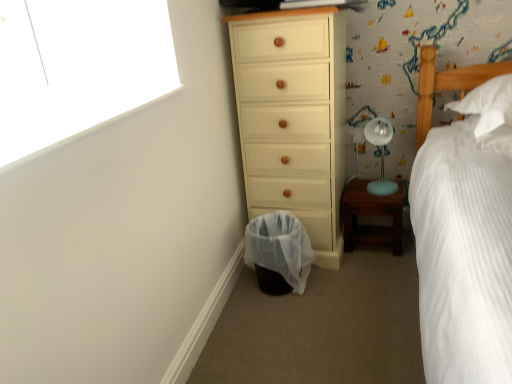
Locate an element on the screen. vacant position to the left of translucent plastic laundry basket at lower center is located at coordinates (241, 296).